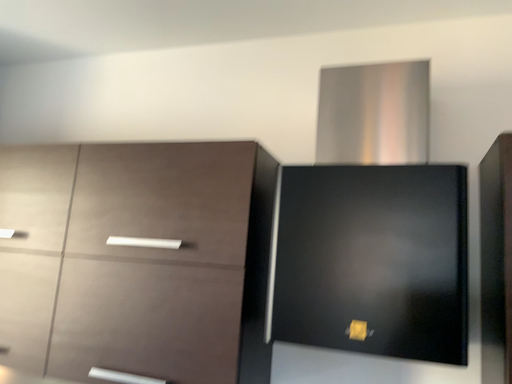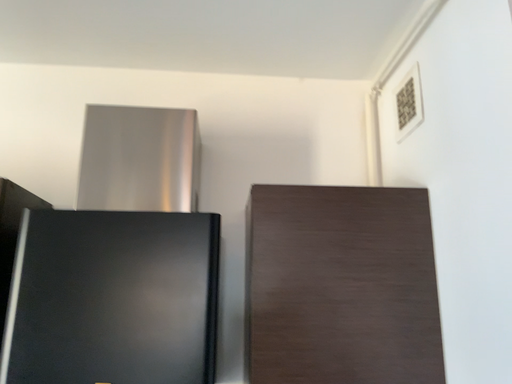
Question: Which way did the camera rotate in the video?

Choices:
 (A) rotated right
 (B) rotated left

Answer: (A)